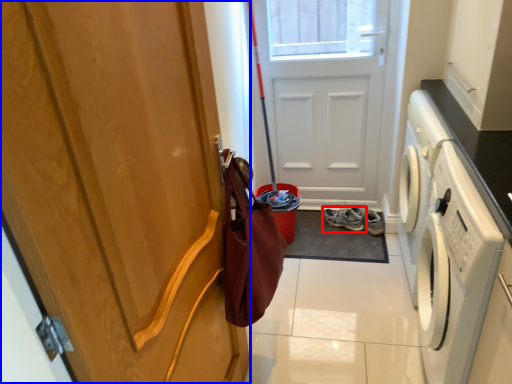
Question: Which object appears closest to the camera in this image, footwear (highlighted by a red box) or door (highlighted by a blue box)?

Choices:
 (A) footwear
 (B) door

Answer: (B)